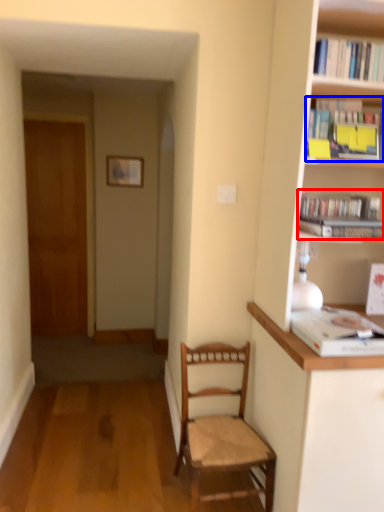
Question: Which object is closer to the camera taking this photo, book (highlighted by a red box) or book (highlighted by a blue box)?

Choices:
 (A) book
 (B) book

Answer: (B)